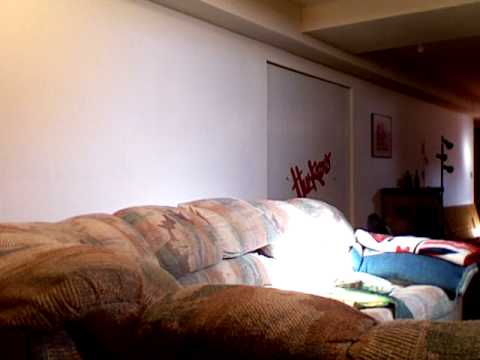
The width and height of the screenshot is (480, 360). Identify the location of picture on wall. (382, 137).